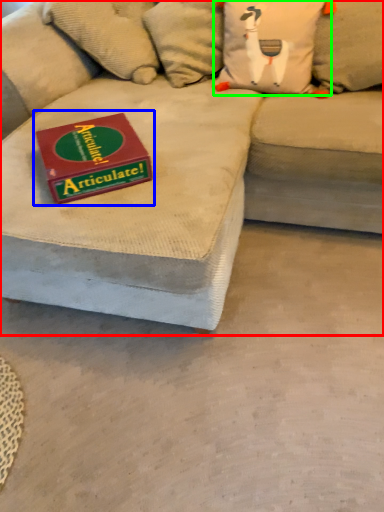
Question: Considering the real-world distances, which object is closest to studio couch (highlighted by a red box)? paperback book (highlighted by a blue box) or pillow (highlighted by a green box).

Choices:
 (A) paperback book
 (B) pillow

Answer: (A)